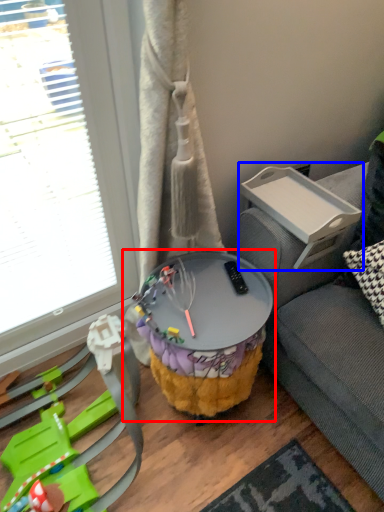
Question: Which object appears closest to the camera in this image, table (highlighted by a red box) or table (highlighted by a blue box)?

Choices:
 (A) table
 (B) table

Answer: (A)